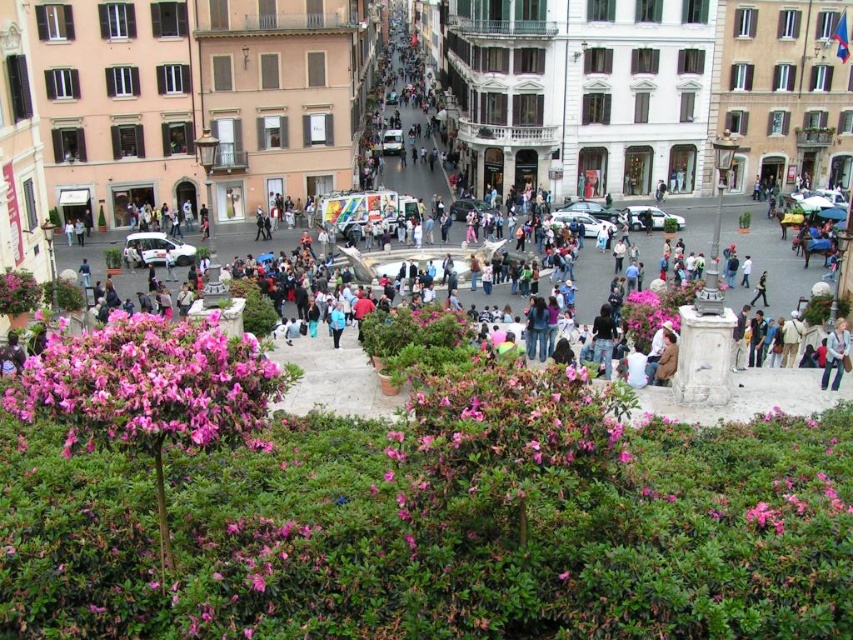
Question: Which point is farther to the camera?

Choices:
 (A) (254, 422)
 (B) (831, 356)

Answer: (B)

Question: Can you confirm if pink glossy bush at lower left is bigger than blue denim jeans at lower right?

Choices:
 (A) no
 (B) yes

Answer: (B)

Question: Which point is farther to the camera?

Choices:
 (A) pink glossy bush at lower left
 (B) blue denim jeans at lower right

Answer: (B)

Question: Is pink glossy bush at lower left thinner than blue denim jeans at lower right?

Choices:
 (A) yes
 (B) no

Answer: (B)

Question: Which object appears farthest from the camera in this image?

Choices:
 (A) pink glossy bush at lower left
 (B) blue denim jeans at lower right

Answer: (B)

Question: Is pink glossy bush at lower left to the left of blue denim jeans at lower right from the viewer's perspective?

Choices:
 (A) no
 (B) yes

Answer: (B)